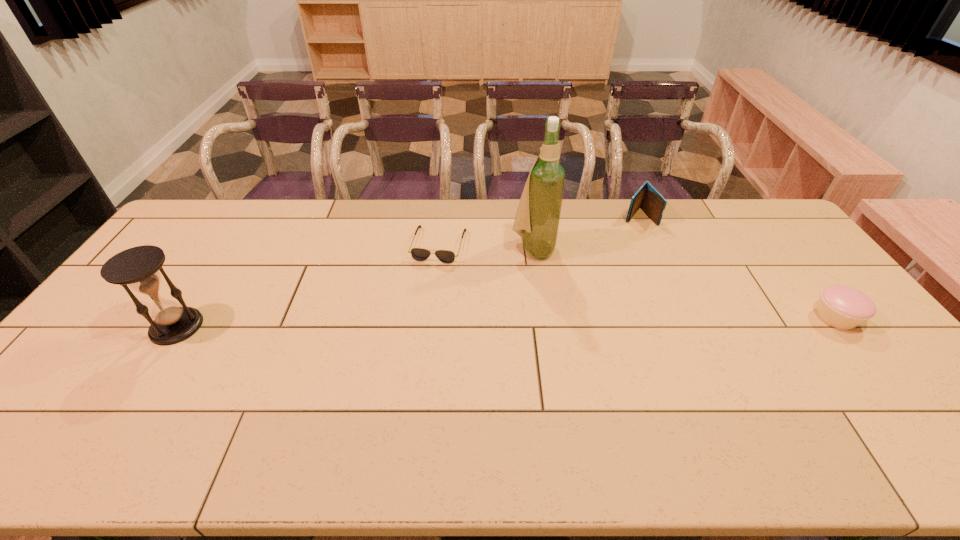
Find the location of a particular element. The height and width of the screenshot is (540, 960). vacant region located 0.120m on the front-facing side of the second object from left to right is located at coordinates (425, 289).

This screenshot has width=960, height=540. Identify the location of wine bottle that is at the far edge. (537, 219).

Where is `wallet that is at the far edge`? Image resolution: width=960 pixels, height=540 pixels. wallet that is at the far edge is located at coordinates (647, 198).

The height and width of the screenshot is (540, 960). In order to click on sunglasses that is at the far edge in this screenshot , I will do `click(419, 254)`.

Where is `object positioned at the right edge`? object positioned at the right edge is located at coordinates (842, 307).

Locate an element on the screen. Image resolution: width=960 pixels, height=540 pixels. vacant region at the far edge is located at coordinates (667, 201).

At what (x,y) coordinates should I click in order to perform the action: click on vacant region at the near edge of the desktop. Please return your answer as a coordinate pair (x, y). The height and width of the screenshot is (540, 960). Looking at the image, I should click on (361, 402).

The width and height of the screenshot is (960, 540). I want to click on vacant space at the right edge, so click(818, 332).

Locate an element on the screen. The width and height of the screenshot is (960, 540). free space between the cupcake and the third object from left to right is located at coordinates (684, 283).

The height and width of the screenshot is (540, 960). Identify the location of free space between the leftmost object and the fourth object from right to left. (308, 286).